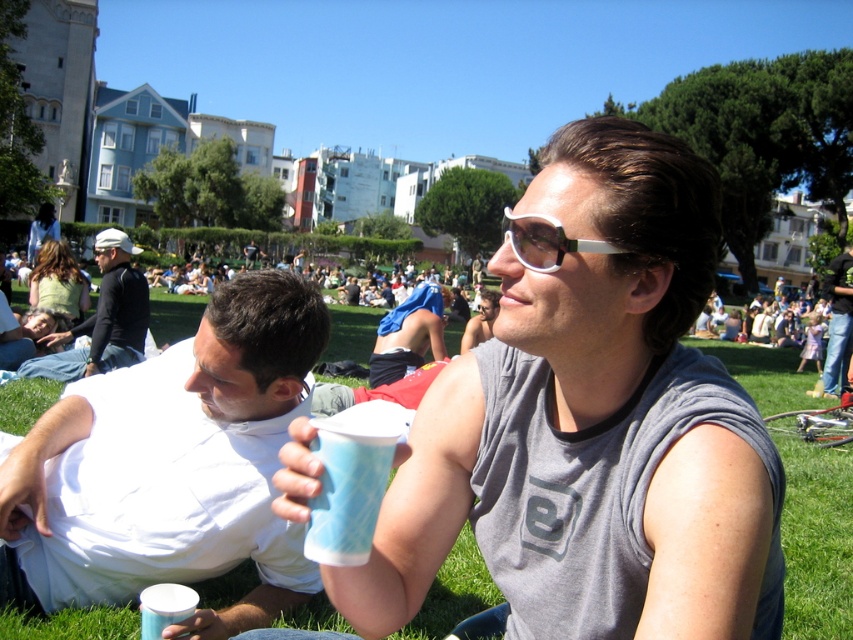
You are standing at the center of the image. Which direction should you look to see the white matte cup at lower left?

The white matte cup at lower left is located at coordinate point (170, 467), so you should look to the lower left direction to see it.

You are standing in the park and see the green grass at center and the white plastic goggles at center. Which object is positioned to the left?

The green grass at center is to the left of the white plastic goggles at center.